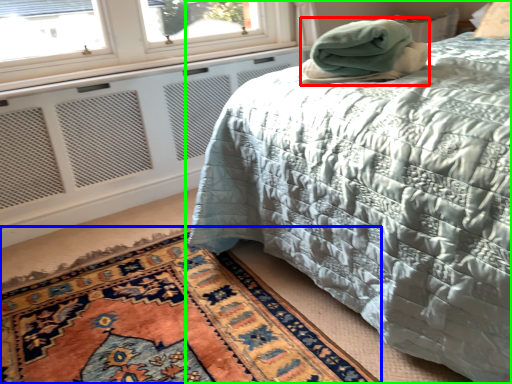
Question: Estimate the real-world distances between objects in this image. Which object is closer to blanket (highlighted by a red box), mat (highlighted by a blue box) or bed (highlighted by a green box)?

Choices:
 (A) mat
 (B) bed

Answer: (B)